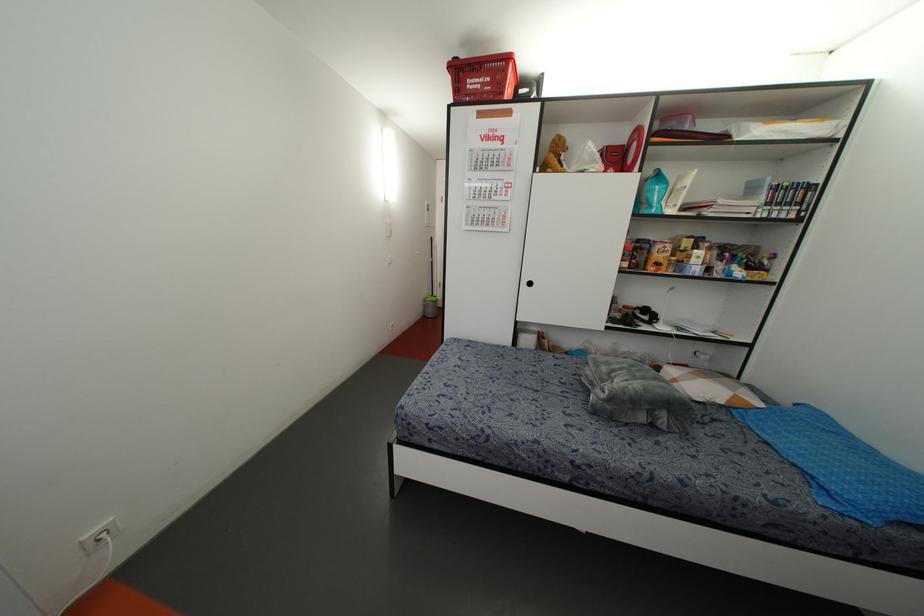
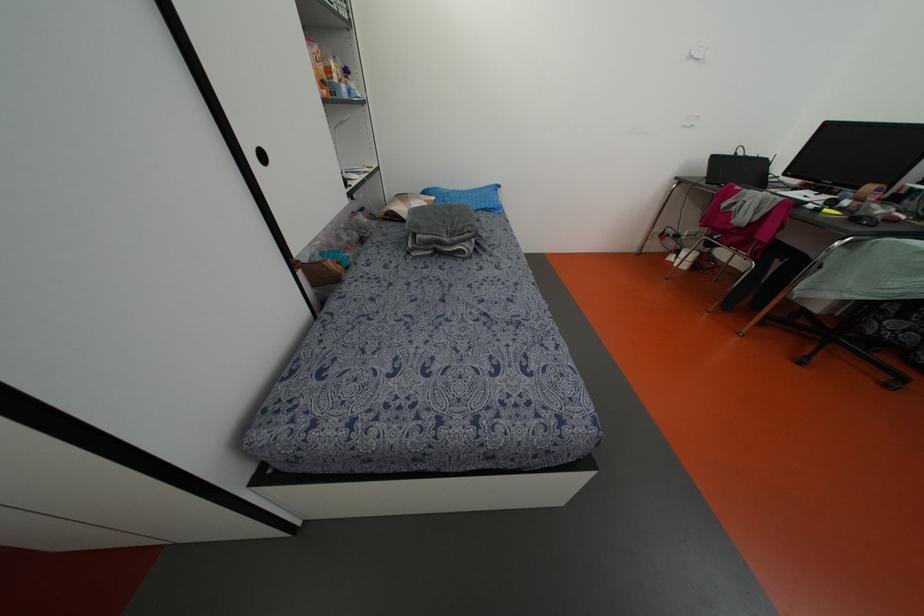
Locate, in the second image, the point that corresponds to (831,487) in the first image.

(492, 206)